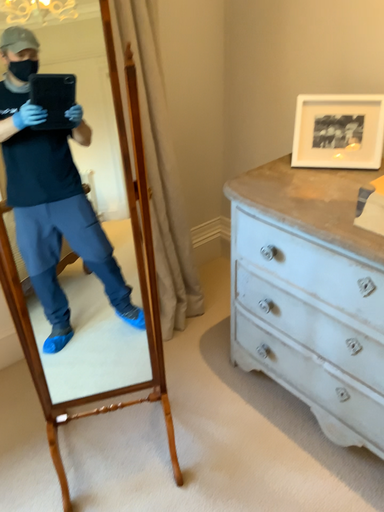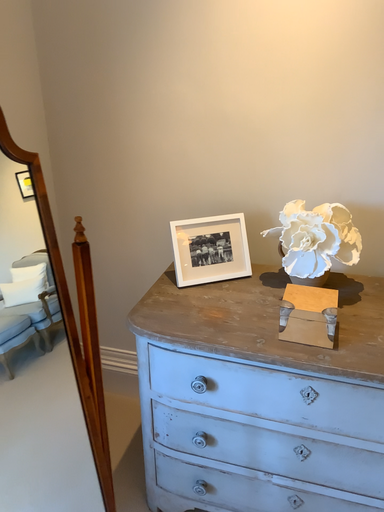
Question: Which way did the camera rotate in the video?

Choices:
 (A) rotated upward
 (B) rotated downward

Answer: (A)